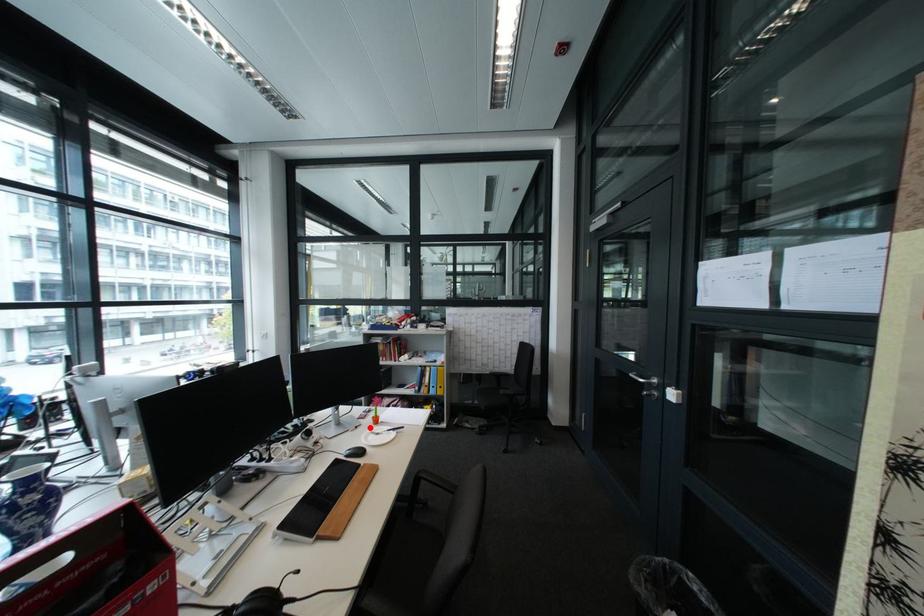
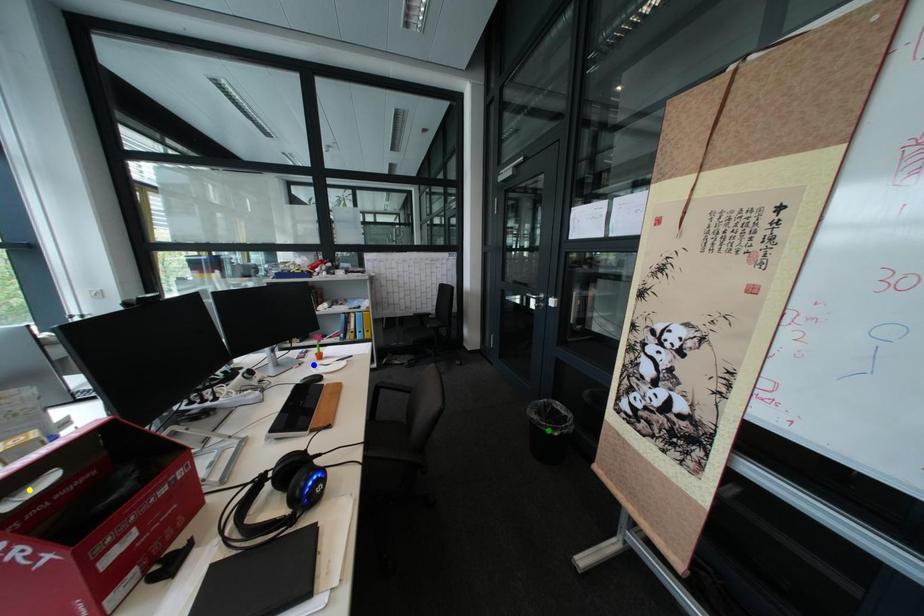
Question: I am providing you with two images of the same scene from different viewpoints. A red point is marked on the first image. You are given multiple points on the second image. Which point in image 2 represents the same 3d spot as the red point in image 1?

Choices:
 (A) green point
 (B) yellow point
 (C) blue point

Answer: (C)